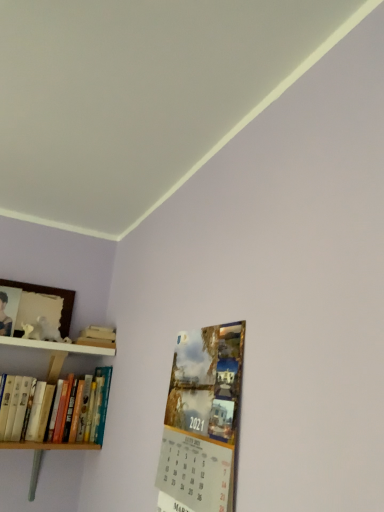
Question: Is matte paper calendar at lower right at the left side of hardcover books at left?

Choices:
 (A) yes
 (B) no

Answer: (B)

Question: From the image's perspective, is matte paper calendar at lower right located above hardcover books at left?

Choices:
 (A) no
 (B) yes

Answer: (B)

Question: Would you consider matte paper calendar at lower right to be distant from hardcover books at left?

Choices:
 (A) yes
 (B) no

Answer: (B)

Question: Can you confirm if matte paper calendar at lower right is smaller than hardcover books at left?

Choices:
 (A) no
 (B) yes

Answer: (B)

Question: Is the position of matte paper calendar at lower right less distant than that of hardcover books at left?

Choices:
 (A) no
 (B) yes

Answer: (B)

Question: From the image's perspective, relative to hardcover books at left, is matte paper calendar at lower right above or below?

Choices:
 (A) below
 (B) above

Answer: (B)

Question: Is matte paper calendar at lower right in front of or behind hardcover books at left in the image?

Choices:
 (A) behind
 (B) front

Answer: (B)

Question: Is matte paper calendar at lower right bigger or smaller than hardcover books at left?

Choices:
 (A) small
 (B) big

Answer: (A)

Question: Considering the positions of point (167, 439) and point (16, 441), is point (167, 439) closer or farther from the camera than point (16, 441)?

Choices:
 (A) closer
 (B) farther

Answer: (A)

Question: Based on their sizes in the image, would you say matte paper calendar at lower right is bigger or smaller than wooden shelf at upper left?

Choices:
 (A) big
 (B) small

Answer: (A)

Question: Is matte paper calendar at lower right inside the boundaries of wooden shelf at upper left, or outside?

Choices:
 (A) inside
 (B) outside

Answer: (B)

Question: Would you say matte paper calendar at lower right is to the left or to the right of wooden shelf at upper left in the picture?

Choices:
 (A) right
 (B) left

Answer: (A)

Question: From a real-world perspective, is matte paper calendar at lower right above or below wooden shelf at upper left?

Choices:
 (A) above
 (B) below

Answer: (B)

Question: Is wooden shelf at upper left inside the boundaries of matte paper calendar at lower right, or outside?

Choices:
 (A) outside
 (B) inside

Answer: (A)

Question: Is point (39, 344) closer or farther from the camera than point (193, 505)?

Choices:
 (A) farther
 (B) closer

Answer: (A)